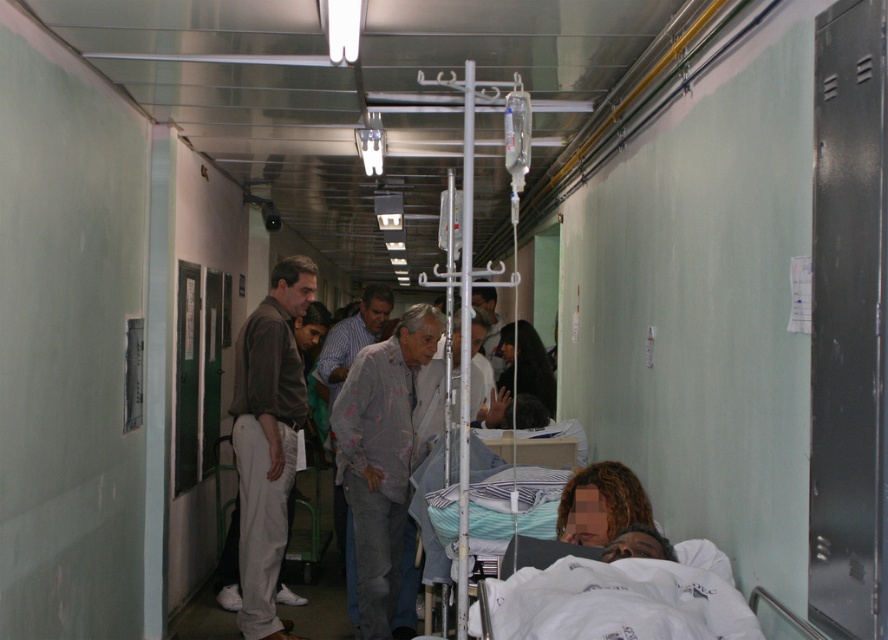
Does light brown fabric pants at left lie in front of dark brown hair at center?

Yes, light brown fabric pants at left is in front of dark brown hair at center.

Does point (260, 304) come behind point (524, 365)?

No.

Identify the location of light brown fabric pants at left. (268, 440).